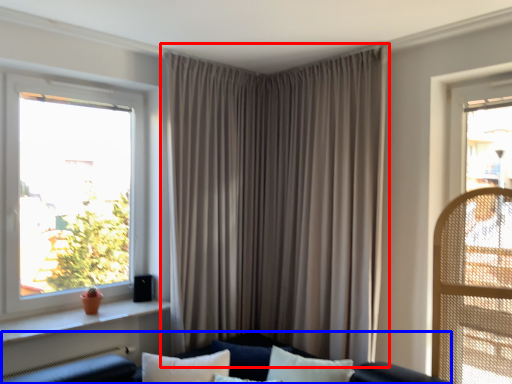
Question: Which object is closer to the camera taking this photo, curtain (highlighted by a red box) or couch (highlighted by a blue box)?

Choices:
 (A) curtain
 (B) couch

Answer: (B)